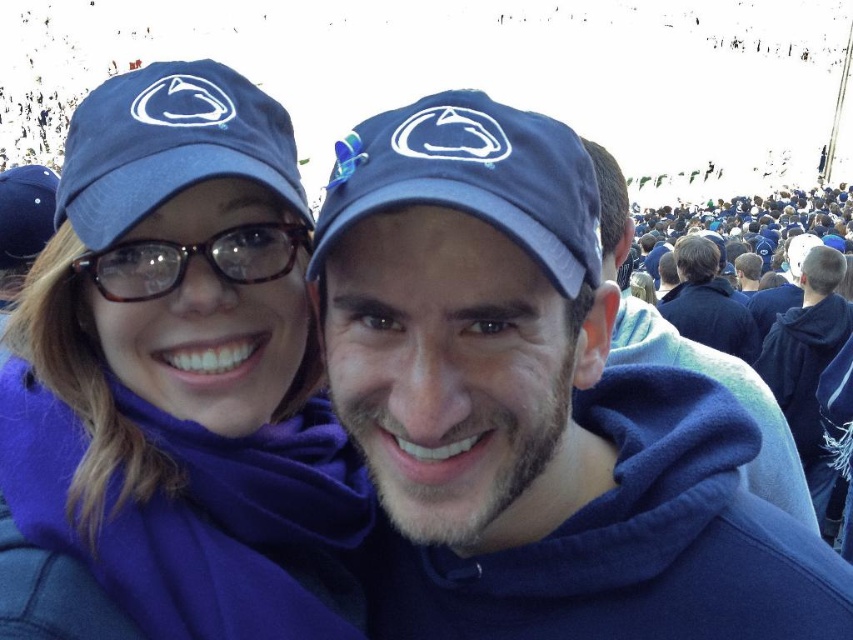
Between matte blue cap at upper left and blue fleece jacket at right, which one is positioned higher?

Positioned higher is matte blue cap at upper left.

Is matte blue cap at upper left thinner than blue fleece jacket at right?

No.

Describe the element at coordinates (178, 365) in the screenshot. I see `matte blue cap at upper left` at that location.

You are a GUI agent. You are given a task and a screenshot of the screen. Output one action in this format:
    pyautogui.click(x=<x>, y=<y>)
    Task: Click on the matte blue cap at upper left
    Image resolution: width=853 pixels, height=640 pixels.
    Given the screenshot: What is the action you would take?
    pyautogui.click(x=178, y=365)

Is point (699, 540) farther from viewer compared to point (306, 589)?

Yes, point (699, 540) is behind point (306, 589).

Who is higher up, matte blue cap at center or matte blue cap at upper left?

matte blue cap at upper left is above.

Consider the image. Who is more distant from viewer, (483, 525) or (202, 180)?

The point (483, 525) is more distant.

You are a GUI agent. You are given a task and a screenshot of the screen. Output one action in this format:
    pyautogui.click(x=<x>, y=<y>)
    Task: Click on the matte blue cap at center
    This screenshot has width=853, height=640.
    Given the screenshot: What is the action you would take?
    pyautogui.click(x=532, y=406)

Can you confirm if blue fleece at center is positioned below blue fleece jacket at right?

Actually, blue fleece at center is above blue fleece jacket at right.

Is blue fleece at center to the right of blue fleece jacket at right from the viewer's perspective?

In fact, blue fleece at center is to the left of blue fleece jacket at right.

Who is more forward, (682, 336) or (816, 410)?

Point (816, 410) is in front.

Find the location of a particular element. blue fleece at center is located at coordinates (729, 390).